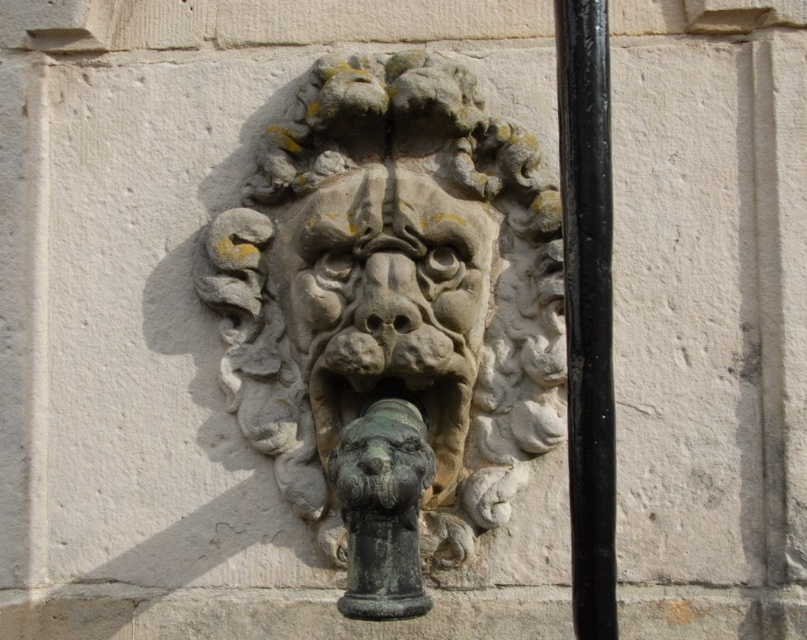
You are an art restorer examining the carving. You need to place a protective cover over both the stone textured face at center and the black metal pole at right. If the cover can only fit objects up to the size of the larger one, which object determines the minimum required size for the cover?

The stone textured face at center determines the minimum required size for the cover because its width is larger than the black metal pole at right.

Consider the image. You are standing in front of the stone carving and want to touch the point at coordinates point (404, 234) on the wall. If your arm can reach up to 1.5 meters, will you be able to reach it?

The distance between point (404, 234) and the camera is 1.73 meters, which is beyond your arm reach of 1.5 meters. Therefore, you cannot reach the point at point (404, 234).

You are an art conservator examining the stone carving. You notice two features at the center of the carving. One is the stone textured lion head at center and the other is the stone textured face at center. Which one is located higher up in the carving?

The stone textured face at center is located higher up in the carving because the stone textured lion head at center is positioned under it.